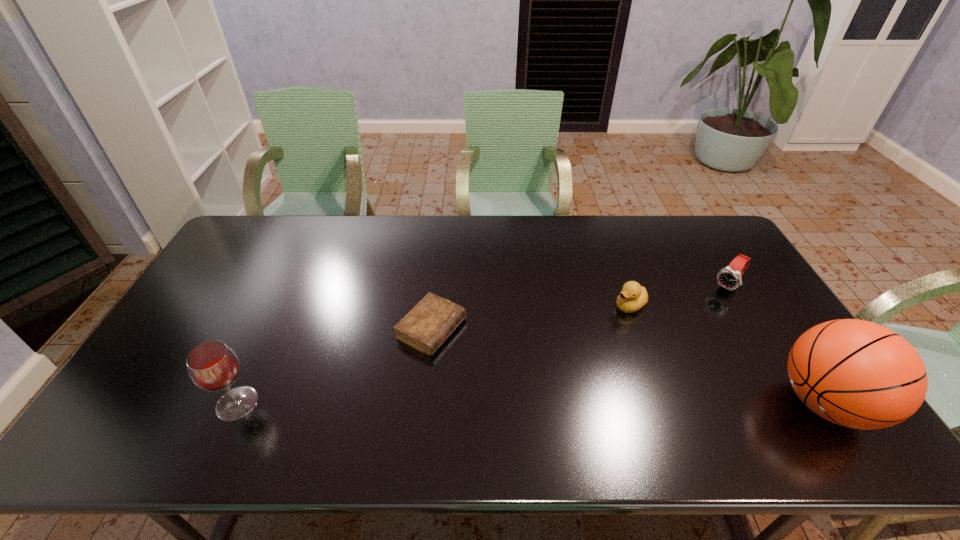
Locate an element on the screen. The image size is (960, 540). free space between the tallest object and the third object from right to left is located at coordinates (728, 354).

Find the location of a particular element. This screenshot has height=540, width=960. free area in between the watch and the third object from left to right is located at coordinates (679, 296).

The image size is (960, 540). Identify the location of free space between the leftmost object and the third object from right to left. (434, 354).

At what (x,y) coordinates should I click in order to perform the action: click on free spot between the basketball and the leftmost object. Please return your answer as a coordinate pair (x, y). The image size is (960, 540). Looking at the image, I should click on (532, 403).

Locate an element on the screen. The image size is (960, 540). free space between the second tallest object and the tallest object is located at coordinates (532, 403).

Find the location of a particular element. vacant area between the second object from left to right and the watch is located at coordinates 580,308.

You are a GUI agent. You are given a task and a screenshot of the screen. Output one action in this format:
    pyautogui.click(x=<x>, y=<y>)
    Task: Click on the vacant area that lies between the basketball and the second tallest object
    Image resolution: width=960 pixels, height=540 pixels.
    Given the screenshot: What is the action you would take?
    pyautogui.click(x=532, y=403)

Identify the location of free space between the second tallest object and the fourth object from right to left. The width and height of the screenshot is (960, 540). (334, 366).

Identify the location of free space between the wineglass and the watch. (483, 345).

The width and height of the screenshot is (960, 540). Find the location of `the closest object to the wineglass`. the closest object to the wineglass is located at coordinates (425, 327).